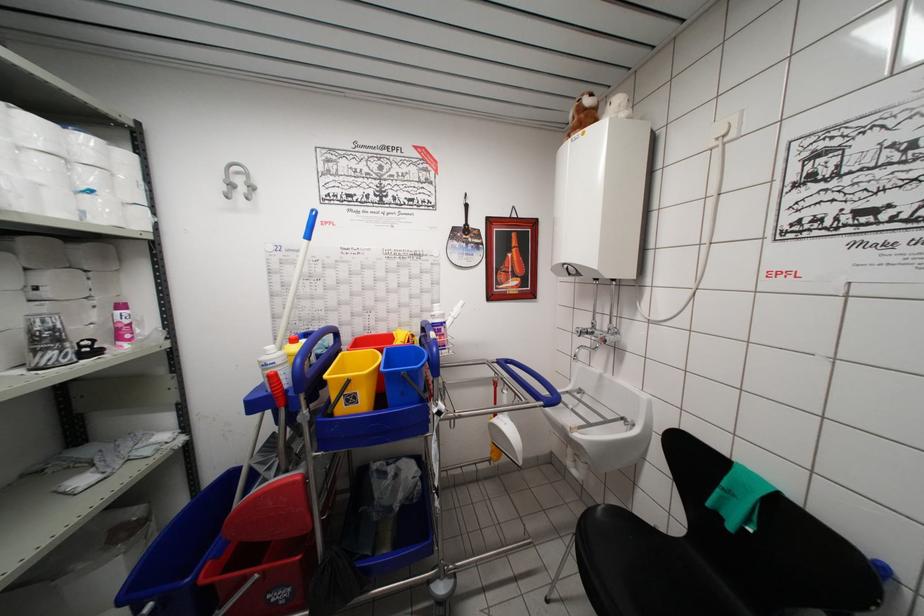
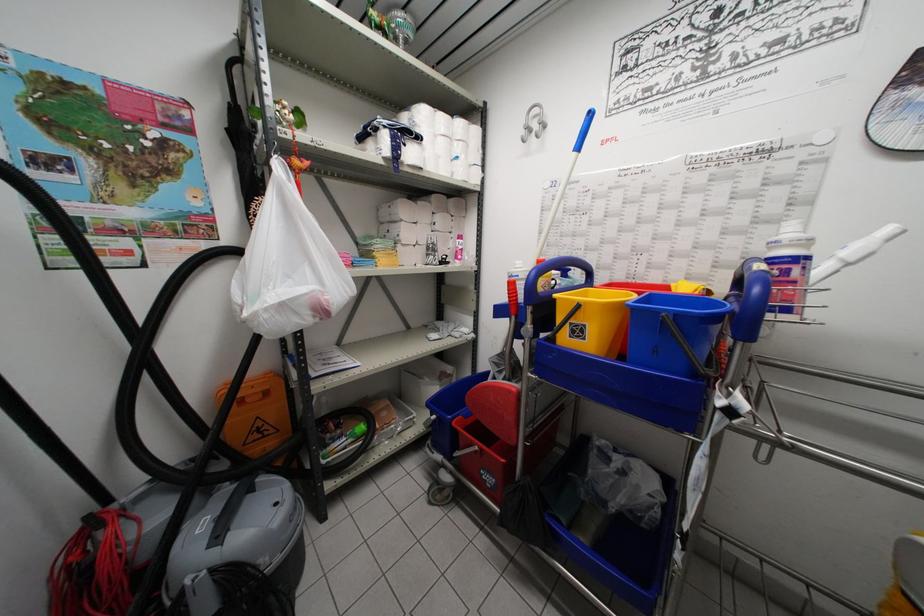
Question: The first image is from the beginning of the video and the second image is from the end. How did the camera likely rotate when shooting the video?

Choices:
 (A) Left
 (B) Right
 (C) Up
 (D) Down

Answer: (A)